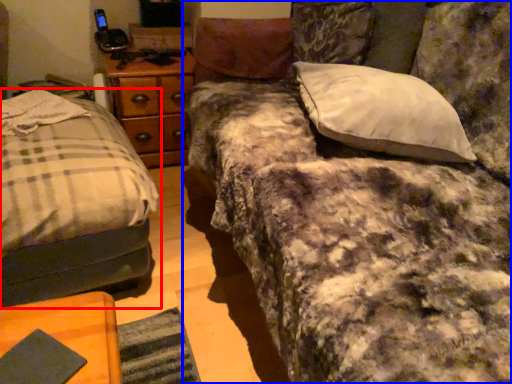
Question: Which object is further to the camera taking this photo, bed (highlighted by a red box) or studio couch (highlighted by a blue box)?

Choices:
 (A) bed
 (B) studio couch

Answer: (A)